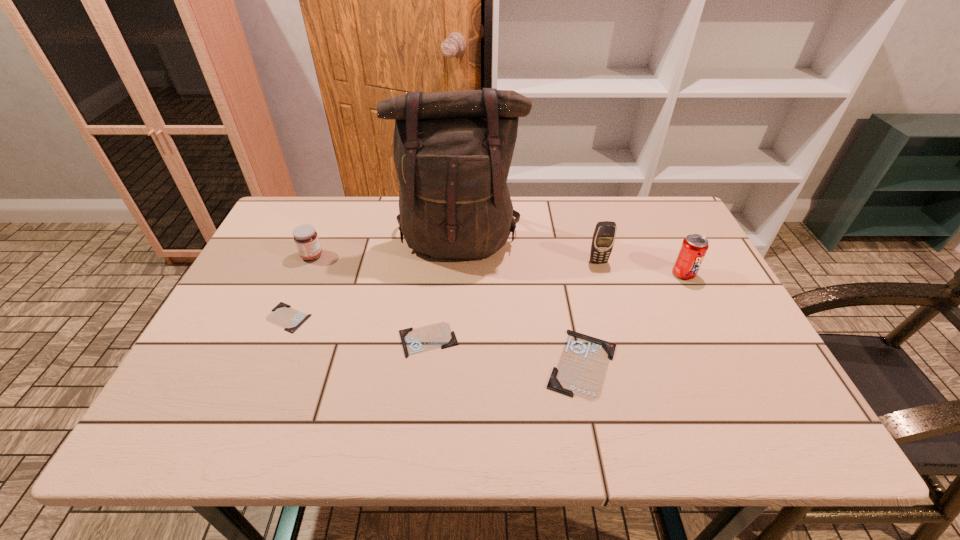
Where is `the shortest object`? The height and width of the screenshot is (540, 960). the shortest object is located at coordinates (283, 315).

The width and height of the screenshot is (960, 540). Find the location of `the shortest identity card`. the shortest identity card is located at coordinates [x=283, y=315].

Locate an element on the screen. The width and height of the screenshot is (960, 540). the second shortest object is located at coordinates (439, 335).

Image resolution: width=960 pixels, height=540 pixels. I want to click on the second identity card from left to right, so click(x=439, y=335).

Identify the location of the third shortest object. This screenshot has height=540, width=960. pos(581,370).

Locate an element on the screen. This screenshot has width=960, height=540. the tallest identity card is located at coordinates click(x=581, y=370).

This screenshot has width=960, height=540. What are the coordinates of `backpack` in the screenshot? It's located at (453, 149).

This screenshot has width=960, height=540. I want to click on the third tallest object, so click(694, 247).

At what (x,y) coordinates should I click in order to perform the action: click on soda can. Please return your answer as a coordinate pair (x, y). Looking at the image, I should click on pyautogui.click(x=694, y=247).

The width and height of the screenshot is (960, 540). I want to click on jam, so click(x=306, y=239).